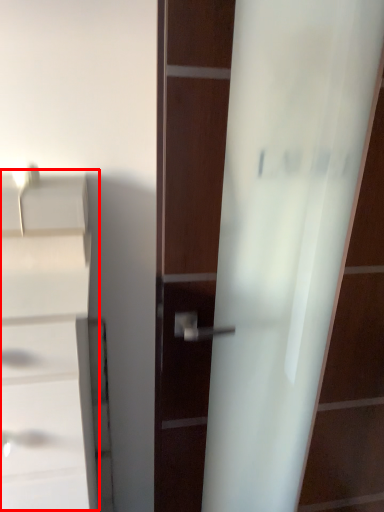
Question: Observing the image, what is the correct spatial positioning of cabinetry (annotated by the red box) in reference to screen door?

Choices:
 (A) left
 (B) right

Answer: (A)